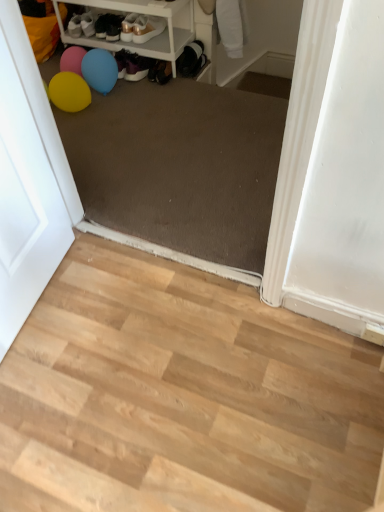
Question: From their relative heights in the image, would you say matte white screen door at left is taller or shorter than shiny gold shoe at upper center, which ranks as the 2th footwear in right-to-left order?

Choices:
 (A) short
 (B) tall

Answer: (B)

Question: From a real-world perspective, is matte white screen door at left above or below shiny gold shoe at upper center, which ranks as the 2th footwear in right-to-left order?

Choices:
 (A) above
 (B) below

Answer: (A)

Question: Which of these objects is positioned closest to the shiny gold shoe at upper center, which ranks as the 2th footwear in right-to-left order?

Choices:
 (A) light wood floor at lower left
 (B) pink rubber balloon at upper left
 (C) matte black shoes at upper center, the 3th footwear positioned from the right
 (D) matte white shoe at upper left
 (E) matte white screen door at left

Answer: (C)

Question: Which object is the farthest from the shiny gold shoe at upper center, which ranks as the 2th footwear in right-to-left order?

Choices:
 (A) pink rubber balloon at upper left
 (B) white plastic shelf at upper left
 (C) matte black shoes at upper center, which ranks as the 1th footwear in left-to-right order
 (D) matte white shoe at upper left
 (E) matte white sneakers at upper center, the third footwear from the left

Answer: (A)